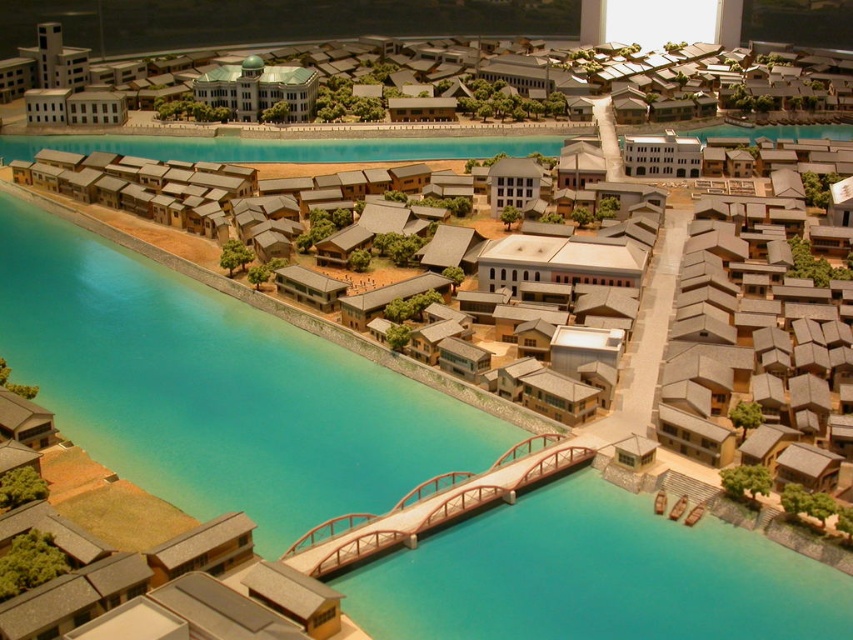
Question: Where is transparent blue water at center located in relation to matte white building at center in the image?

Choices:
 (A) left
 (B) right

Answer: (B)

Question: Can you confirm if wooden bridge at center is positioned above matte white building at center?

Choices:
 (A) yes
 (B) no

Answer: (B)

Question: Is transparent blue water at center bigger than matte white building at center?

Choices:
 (A) yes
 (B) no

Answer: (A)

Question: Which is farther from the wooden bridge at center?

Choices:
 (A) transparent blue water at center
 (B) matte white building at center

Answer: (B)

Question: Which is farther from the matte white building at center?

Choices:
 (A) wooden bridge at center
 (B) transparent blue water at center

Answer: (A)

Question: Which is nearer to the matte white building at center?

Choices:
 (A) transparent blue water at center
 (B) wooden bridge at center

Answer: (A)